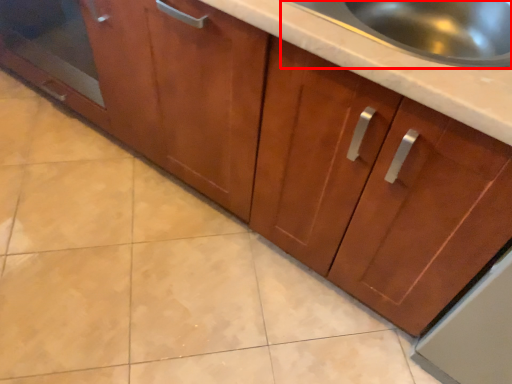
Question: Considering the relative positions of sink (annotated by the red box) and glass door in the image provided, where is sink (annotated by the red box) located with respect to the staircase?

Choices:
 (A) right
 (B) left

Answer: (A)